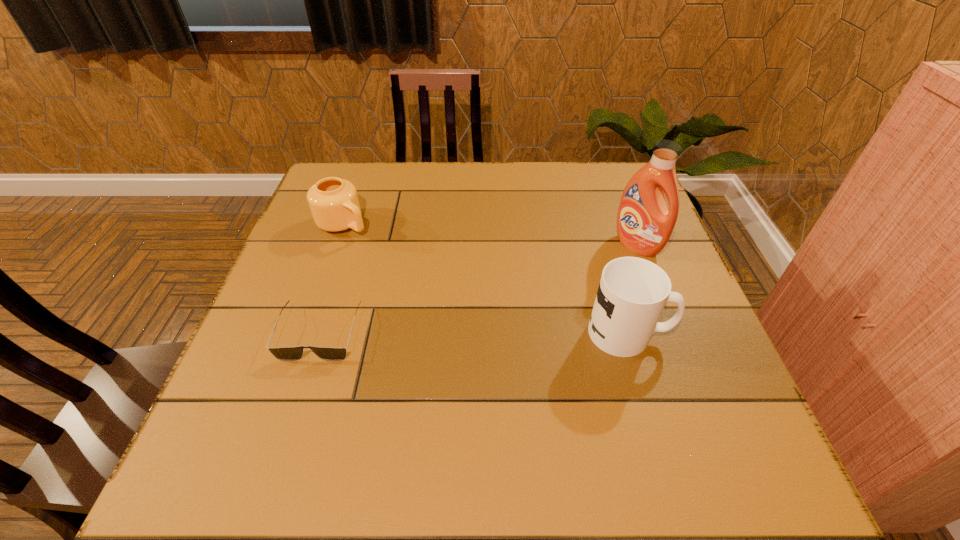
Locate which object is the third closest to the left mug. Please provide its 2D coordinates. Your answer should be formatted as a tuple, i.e. [(x, y)], where the tuple contains the x and y coordinates of a point satisfying the conditions above.

[(644, 225)]

Select which object is the third closest to the shortest object. Please provide its 2D coordinates. Your answer should be formatted as a tuple, i.e. [(x, y)], where the tuple contains the x and y coordinates of a point satisfying the conditions above.

[(644, 225)]

The height and width of the screenshot is (540, 960). I want to click on vacant position in the image that satisfies the following two spatial constraints: 1. on the front side of the farther mug; 2. on the handle side of the third shortest object, so click(305, 333).